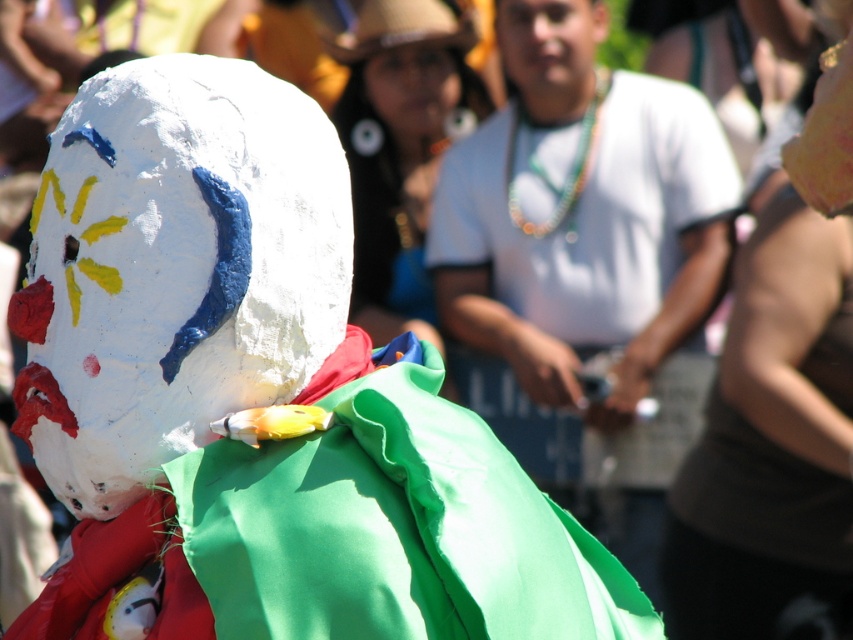
Which is below, matte papier-mâché snowman at center or matte white mask at upper center?

matte papier-mâché snowman at center is below.

Between matte papier-mâché snowman at center and matte white mask at upper center, which one has more height?

With more height is matte papier-mâché snowman at center.

Which is behind, point (158, 317) or point (426, 81)?

Positioned behind is point (426, 81).

You are a GUI agent. You are given a task and a screenshot of the screen. Output one action in this format:
    pyautogui.click(x=<x>, y=<y>)
    Task: Click on the matte papier-mâché snowman at center
    
    Given the screenshot: What is the action you would take?
    pyautogui.click(x=260, y=396)

Is point (576, 225) positioned in front of point (511, 29)?

Yes, it is in front of point (511, 29).

Locate an element on the screen. The width and height of the screenshot is (853, 640). white matte shirt at center is located at coordinates (585, 237).

Who is higher up, matte papier-mâché snowman at center or white matte shirt at center?

Positioned higher is white matte shirt at center.

Does matte papier-mâché snowman at center have a greater height compared to white matte shirt at center?

Indeed, matte papier-mâché snowman at center has a greater height compared to white matte shirt at center.

Which is behind, point (254, 554) or point (514, 298)?

Point (514, 298)

This screenshot has height=640, width=853. I want to click on matte papier-mâché snowman at center, so click(x=260, y=396).